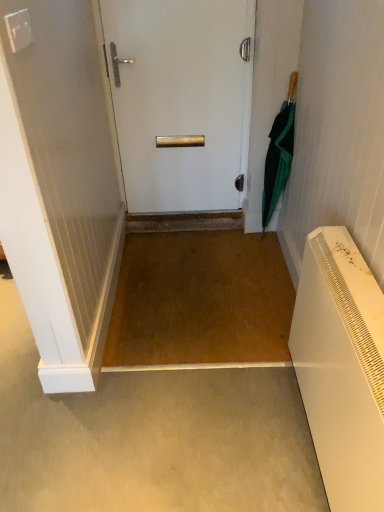
Question: Is white matte door at center taller or shorter than green fabric umbrella at right?

Choices:
 (A) short
 (B) tall

Answer: (B)

Question: Considering the positions of white matte door at center and green fabric umbrella at right in the image, is white matte door at center wider or thinner than green fabric umbrella at right?

Choices:
 (A) thin
 (B) wide

Answer: (A)

Question: From a real-world perspective, is white matte door at center above or below green fabric umbrella at right?

Choices:
 (A) above
 (B) below

Answer: (A)

Question: From a real-world perspective, relative to white matte door at center, is green fabric umbrella at right vertically above or below?

Choices:
 (A) above
 (B) below

Answer: (B)

Question: Considering the positions of point (269, 131) and point (110, 40), is point (269, 131) closer or farther from the camera than point (110, 40)?

Choices:
 (A) closer
 (B) farther

Answer: (B)

Question: Considering their positions, is green fabric umbrella at right located in front of or behind white matte door at center?

Choices:
 (A) behind
 (B) front

Answer: (B)

Question: In terms of width, does green fabric umbrella at right look wider or thinner when compared to white matte door at center?

Choices:
 (A) thin
 (B) wide

Answer: (B)